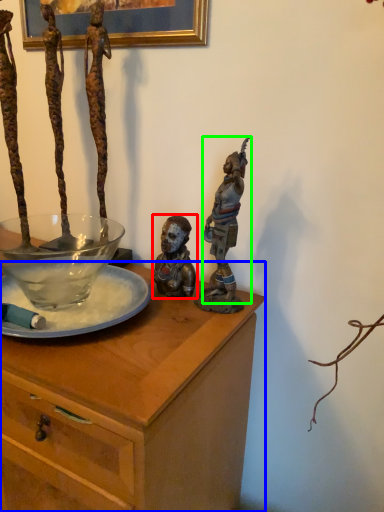
Question: Based on their relative distances, which object is nearer to person (highlighted by a red box)? Choose from desk (highlighted by a blue box) and person (highlighted by a green box).

Choices:
 (A) desk
 (B) person

Answer: (B)